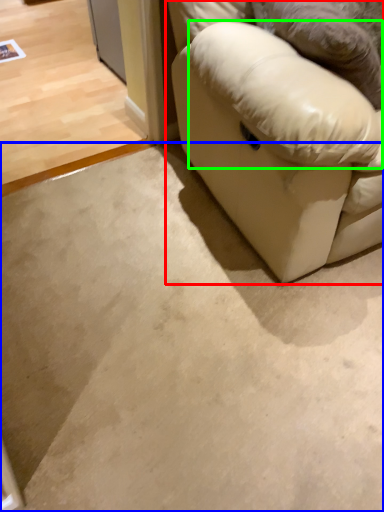
Question: Considering the real-world distances, which object is farthest from studio couch (highlighted by a red box)? concrete (highlighted by a blue box) or pillow (highlighted by a green box)?

Choices:
 (A) concrete
 (B) pillow

Answer: (A)